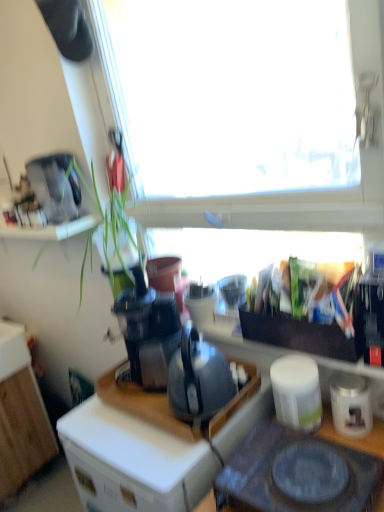
Question: Considering the relative sizes of wooden cabinet at lower left and white plastic drawer at lower left in the image provided, is wooden cabinet at lower left taller than white plastic drawer at lower left?

Choices:
 (A) yes
 (B) no

Answer: (A)

Question: From the image's perspective, is wooden cabinet at lower left under white plastic drawer at lower left?

Choices:
 (A) yes
 (B) no

Answer: (A)

Question: From a real-world perspective, is wooden cabinet at lower left on white plastic drawer at lower left?

Choices:
 (A) no
 (B) yes

Answer: (A)

Question: Is white plastic drawer at lower left surrounded by wooden cabinet at lower left?

Choices:
 (A) yes
 (B) no

Answer: (B)

Question: Considering the relative sizes of wooden cabinet at lower left and white plastic drawer at lower left in the image provided, is wooden cabinet at lower left shorter than white plastic drawer at lower left?

Choices:
 (A) no
 (B) yes

Answer: (A)

Question: Is wooden cabinet at lower left smaller than white plastic drawer at lower left?

Choices:
 (A) no
 (B) yes

Answer: (A)

Question: Is wooden cabinet at lower left beside black glass gas stove at lower center?

Choices:
 (A) yes
 (B) no

Answer: (B)

Question: Is wooden cabinet at lower left outside of black glass gas stove at lower center?

Choices:
 (A) yes
 (B) no

Answer: (A)

Question: Is wooden cabinet at lower left looking in the opposite direction of black glass gas stove at lower center?

Choices:
 (A) yes
 (B) no

Answer: (B)

Question: Could you tell me if wooden cabinet at lower left is turned towards black glass gas stove at lower center?

Choices:
 (A) no
 (B) yes

Answer: (B)

Question: Considering the relative positions of wooden cabinet at lower left and black glass gas stove at lower center in the image provided, is wooden cabinet at lower left behind black glass gas stove at lower center?

Choices:
 (A) yes
 (B) no

Answer: (A)

Question: From the image's perspective, is wooden cabinet at lower left below black glass gas stove at lower center?

Choices:
 (A) yes
 (B) no

Answer: (A)

Question: Considering the relative positions of matte black desk at center and white plastic drawer at lower left in the image provided, is matte black desk at center to the right of white plastic drawer at lower left from the viewer's perspective?

Choices:
 (A) yes
 (B) no

Answer: (A)